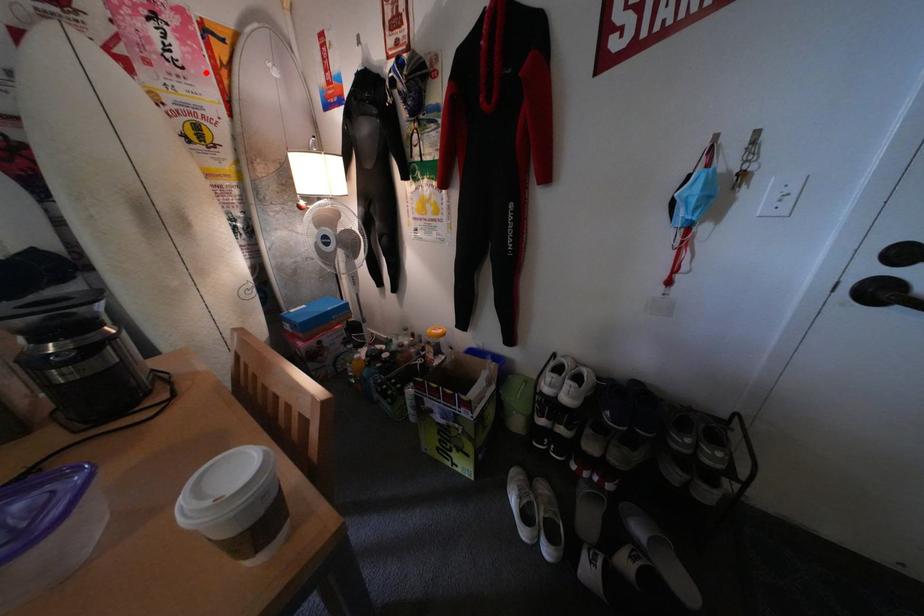
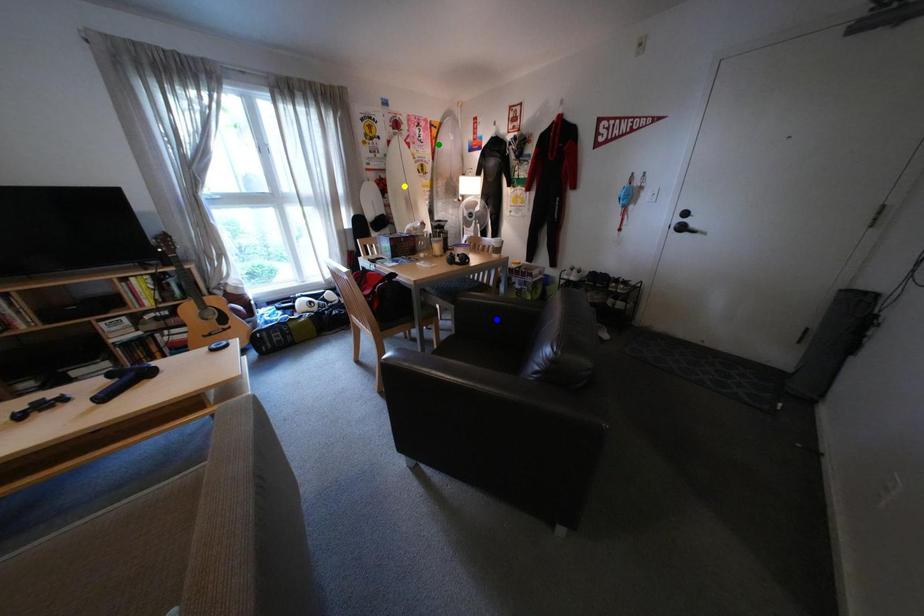
Question: I am providing you with two images of the same scene from different viewpoints. A red point is marked on the first image. You are given multiple points on the second image. Which spot in image 2 lines up with the point in image 1?

Choices:
 (A) green point
 (B) yellow point
 (C) blue point

Answer: (A)